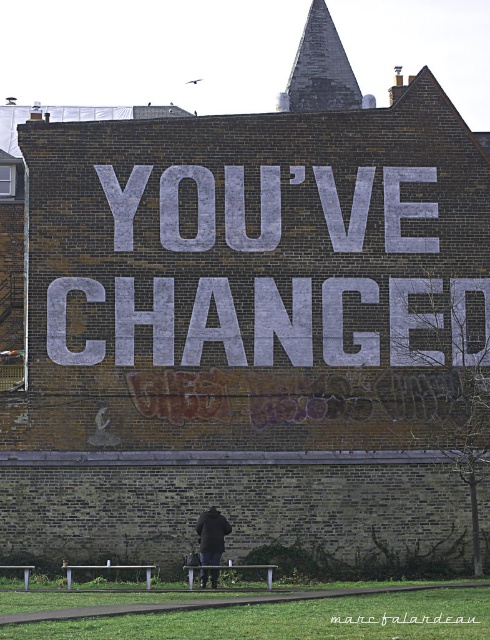
Can you confirm if gray concrete text at center is positioned below dark blue jacket at center?

No, gray concrete text at center is not below dark blue jacket at center.

Who is more forward, (188, 248) or (213, 547)?

Point (213, 547)

Is point (206, 209) positioned before point (212, 512)?

No, (206, 209) is further to viewer.

Locate an element on the screen. gray concrete text at center is located at coordinates (283, 321).